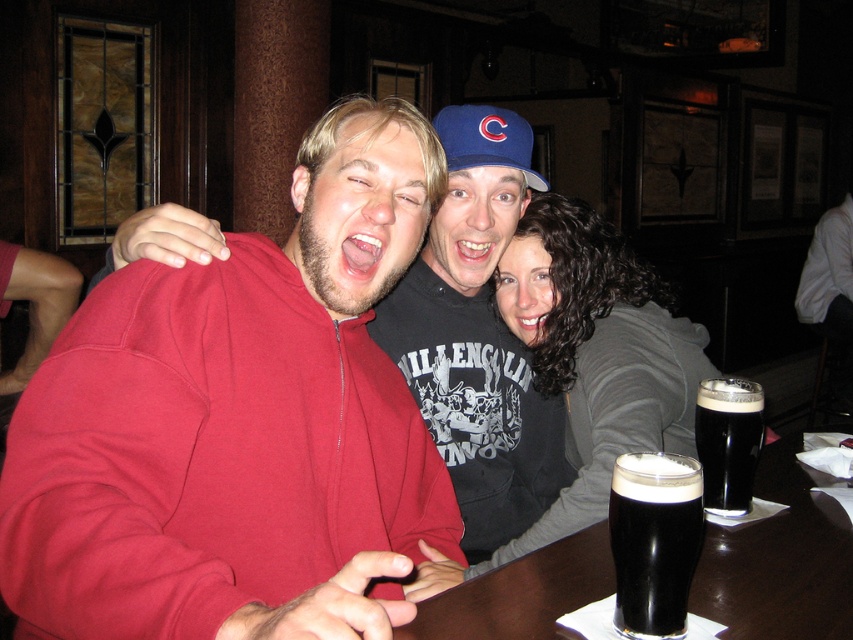
Question: Which is nearer to the smooth dark hair at center?

Choices:
 (A) dark brown liquid at table right
 (B) black matte stout at center
 (C) dark wood table at center

Answer: (A)

Question: Which object is positioned closest to the black matte stout at center?

Choices:
 (A) dark brown liquid at table right
 (B) dark wood table at center
 (C) matte red hoodie at center

Answer: (B)

Question: In this image, where is matte red hoodie at center located relative to dark brown liquid at table right?

Choices:
 (A) above
 (B) below

Answer: (B)

Question: Does dark wood table at center come in front of dark brown liquid at table right?

Choices:
 (A) yes
 (B) no

Answer: (A)

Question: Which object is positioned farthest from the smooth dark hair at center?

Choices:
 (A) dark wood table at center
 (B) matte red hoodie at center

Answer: (B)

Question: Can you confirm if smooth dark hair at center is positioned below dark brown liquid at table right?

Choices:
 (A) yes
 (B) no

Answer: (A)